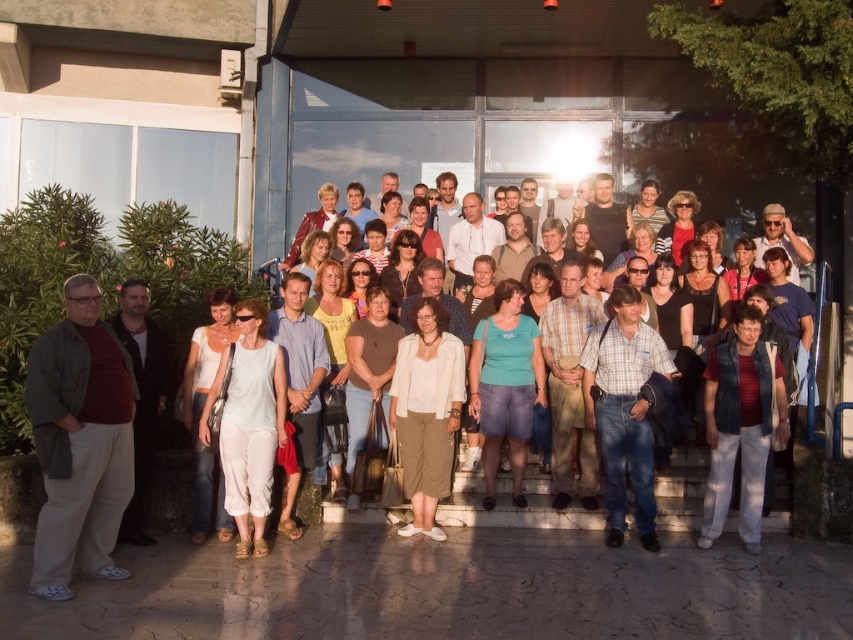
Between white matte jacket at center and white cotton shirt at center, which one appears on the right side from the viewer's perspective?

From the viewer's perspective, white matte jacket at center appears more on the right side.

Describe the element at coordinates (426, 412) in the screenshot. I see `white matte jacket at center` at that location.

At what (x,y) coordinates should I click in order to perform the action: click on white matte jacket at center. Please return your answer as a coordinate pair (x, y). Looking at the image, I should click on (426, 412).

Which is behind, point (38, 573) or point (224, 381)?

The point (224, 381) is behind.

Can you confirm if matte gray jacket at left is taller than light blue fabric dress at center?

Yes.

I want to click on matte gray jacket at left, so pyautogui.click(x=79, y=442).

Is denim vest at lower right shorter than matte green shirt at center?

Correct, denim vest at lower right is not as tall as matte green shirt at center.

Which is in front, point (770, 401) or point (520, 449)?

Point (770, 401)

Between point (715, 484) and point (483, 369), which one is positioned behind?

The point (483, 369) is behind.

Find the location of `denim vest at lower right`. denim vest at lower right is located at coordinates (740, 426).